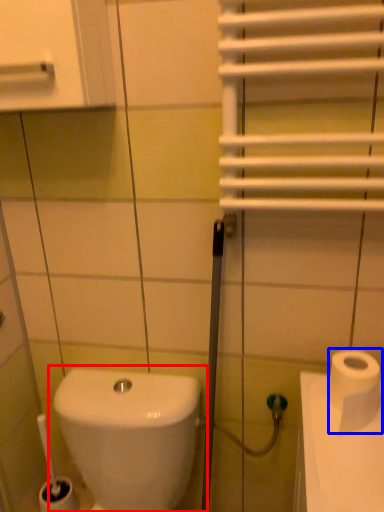
Question: Which object appears farthest to the camera in this image, toilet (highlighted by a red box) or toilet paper (highlighted by a blue box)?

Choices:
 (A) toilet
 (B) toilet paper

Answer: (B)